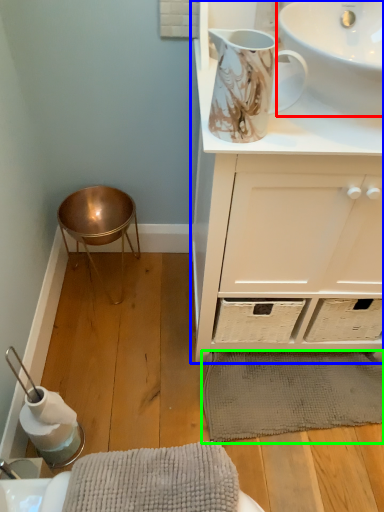
Question: Considering the real-world distances, which object is closest to sink (highlighted by a red box)? bathroom cabinet (highlighted by a blue box) or bath mat (highlighted by a green box).

Choices:
 (A) bathroom cabinet
 (B) bath mat

Answer: (A)